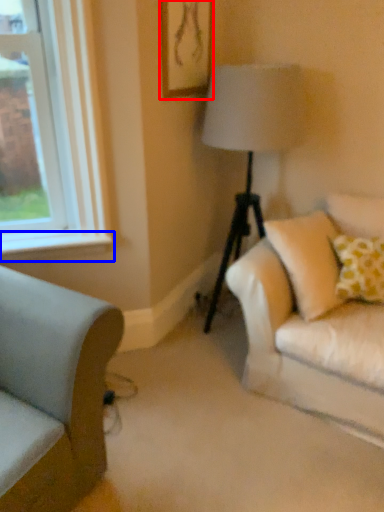
Question: Which of the following is the closest to the observer, picture frame (highlighted by a red box) or window sill (highlighted by a blue box)?

Choices:
 (A) picture frame
 (B) window sill

Answer: (A)